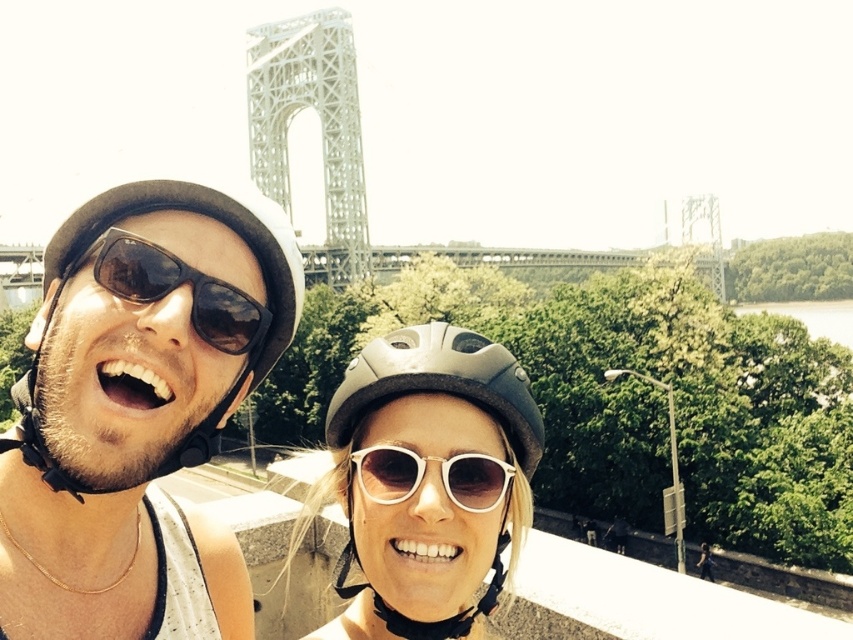
From the picture: You are designing a storage compartment that needs to fit both the matte black helmet at center and the black matte sunglasses at center. If the compartment can only accommodate items up to the size of the larger object, which item determines the minimum required width for the compartment?

The matte black helmet at center determines the minimum required width for the compartment because its width is larger than the black matte sunglasses at center.

You are a photographer trying to capture a closeup shot of the black matte sunglasses at center and the white plastic sunglasses at center. Since both are at the center, which one would appear larger in your photo?

The black matte sunglasses at center is bigger than the white plastic sunglasses at center, so it would appear larger in the photo.

You are a photographer standing at the scene. You want to take a photo that includes both the matte black helmet at center and the black matte sunglasses at center. The minimum distance between the two objects in the photo must be 10 meters. Can you capture them in the same photo with this requirement?

The matte black helmet at center is 11.62 meters away from the black matte sunglasses at center. Since 11.62 meters is greater than the required 10 meters minimum distance, you can capture both objects in the same photo while meeting the requirement.